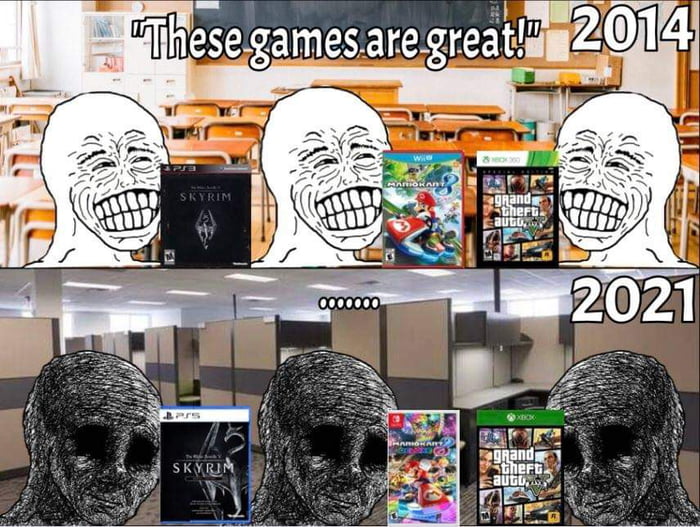
Where is `chalkboard`? chalkboard is located at coordinates pyautogui.click(x=309, y=36).